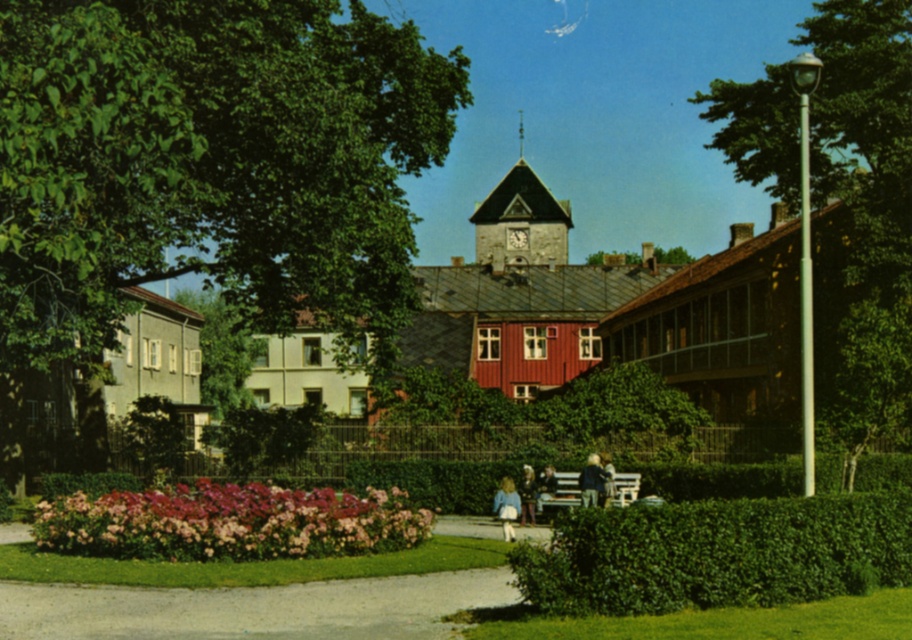
Question: Which of the following is the farthest from the observer?

Choices:
 (A) (379, 552)
 (B) (565, 474)
 (C) (539, 497)

Answer: (B)

Question: Which of these objects is positioned farthest from the green leafy tree at right?

Choices:
 (A) blonde hair at bench right
 (B) pink textured hedge at lower center
 (C) blue denim jacket at center
 (D) light blue denim jacket at lower center

Answer: (B)

Question: Does green leafy tree at upper left have a lesser width compared to light blue denim jacket at lower center?

Choices:
 (A) no
 (B) yes

Answer: (A)

Question: From the image, what is the correct spatial relationship of green leafy tree at upper left in relation to blue denim jacket at center?

Choices:
 (A) right
 (B) left

Answer: (B)

Question: Which object appears closest to the camera in this image?

Choices:
 (A) green leafy tree at right
 (B) green leafy tree at upper left

Answer: (B)

Question: Can you confirm if green leafy tree at right is positioned above green leafy hedge at lower center?

Choices:
 (A) no
 (B) yes

Answer: (B)